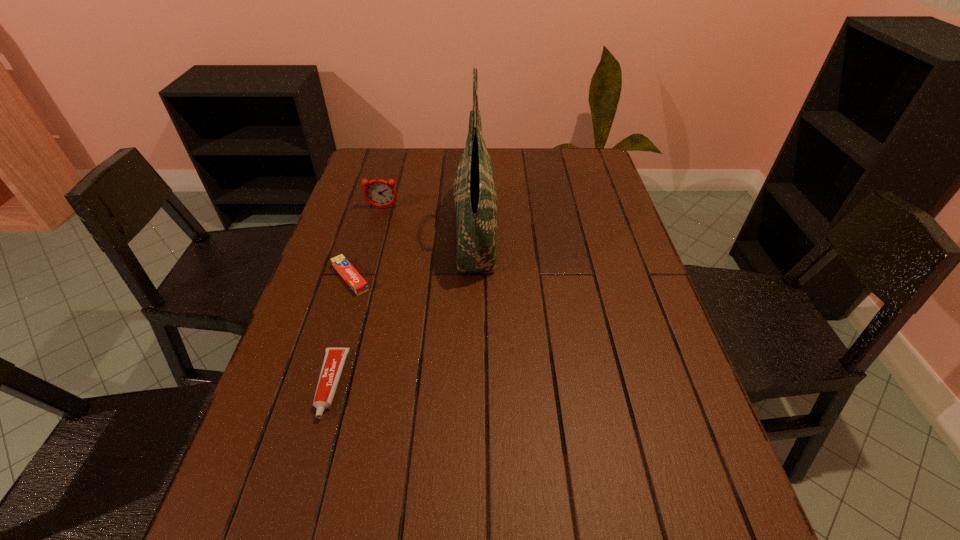
This screenshot has height=540, width=960. I want to click on free space located 0.150m on the back of the farther toothpaste, so click(366, 227).

Find the location of a particular element. alarm clock positioned at the left edge is located at coordinates (379, 193).

The width and height of the screenshot is (960, 540). I want to click on vacant space at the far edge, so click(x=551, y=162).

You are a GUI agent. You are given a task and a screenshot of the screen. Output one action in this format:
    pyautogui.click(x=<x>, y=<y>)
    Task: Click on the free space at the left edge
    Image resolution: width=960 pixels, height=540 pixels.
    Given the screenshot: What is the action you would take?
    pyautogui.click(x=328, y=347)

In the image, there is a desktop. Where is `vacant space at the right edge`? This screenshot has height=540, width=960. vacant space at the right edge is located at coordinates (630, 339).

Where is `free point between the alarm clock and the shorter toothpaste`? Image resolution: width=960 pixels, height=540 pixels. free point between the alarm clock and the shorter toothpaste is located at coordinates (367, 243).

The image size is (960, 540). In order to click on empty space that is in between the shortest object and the taller toothpaste in this screenshot , I will do [x=341, y=331].

You are a GUI agent. You are given a task and a screenshot of the screen. Output one action in this format:
    pyautogui.click(x=<x>, y=<y>)
    Task: Click on the vacant region between the third shortest object and the farther toothpaste
    This screenshot has height=540, width=960.
    Given the screenshot: What is the action you would take?
    pyautogui.click(x=367, y=243)

This screenshot has height=540, width=960. I want to click on free spot between the nearer toothpaste and the third shortest object, so click(356, 296).

Locate an element on the screen. The width and height of the screenshot is (960, 540). free space between the third shortest object and the taller toothpaste is located at coordinates (356, 296).